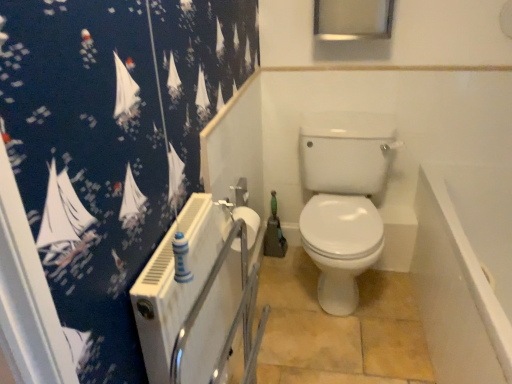
In order to face white glossy bathtub at lower right, should I rotate leftwards or rightwards?

A 31.511 degree turn to the right will do.

Where is `white glossy toilet at center`? white glossy toilet at center is located at coordinates (344, 199).

The image size is (512, 384). Describe the element at coordinates (344, 199) in the screenshot. I see `white glossy toilet at center` at that location.

This screenshot has height=384, width=512. What do you see at coordinates (247, 222) in the screenshot?
I see `white matte toilet paper at center` at bounding box center [247, 222].

This screenshot has height=384, width=512. In order to click on white glossy bathtub at lower right in this screenshot , I will do `click(456, 295)`.

From the image's perspective, is white matte toilet paper at center on top of white glossy toilet at center?

No.

Does white matte toilet paper at center have a larger size compared to white glossy toilet at center?

Incorrect, white matte toilet paper at center is not larger than white glossy toilet at center.

In terms of width, does white matte toilet paper at center look wider or thinner when compared to white glossy toilet at center?

Clearly, white matte toilet paper at center has less width compared to white glossy toilet at center.

You are a GUI agent. You are given a task and a screenshot of the screen. Output one action in this format:
    pyautogui.click(x=<x>, y=<y>)
    Task: Click on the toilet paper located in front of the white glossy toilet at center
    This screenshot has width=512, height=384.
    Given the screenshot: What is the action you would take?
    click(247, 222)

From the image's perspective, between white glossy toilet at center and white matte toilet paper at center, which one is located above?

white glossy toilet at center.

In the scene shown: Considering the positions of objects white glossy toilet at center and white matte toilet paper at center in the image provided, who is more to the right, white glossy toilet at center or white matte toilet paper at center?

white glossy toilet at center is more to the right.

Which of these two, white glossy toilet at center or white matte toilet paper at center, is wider?

Wider between the two is white glossy toilet at center.

Measure the distance from white glossy toilet at center to white matte toilet paper at center.

white glossy toilet at center is 20.13 inches away from white matte toilet paper at center.

Is white glossy bathtub at lower right positioned with its back to white glossy toilet at center?

No.

Where is `toilet behind the white glossy bathtub at lower right`? This screenshot has height=384, width=512. toilet behind the white glossy bathtub at lower right is located at coordinates (344, 199).

Between white glossy bathtub at lower right and white glossy toilet at center, which one has more height?

Standing taller between the two is white glossy toilet at center.

Between point (450, 380) and point (381, 136), which one is positioned behind?

The point (381, 136) is behind.

From a real-world perspective, does white matte toilet paper at center stand above white glossy bathtub at lower right?

Yes.

Consider the image. Is white matte toilet paper at center in front of or behind white glossy bathtub at lower right in the image?

In the image, white matte toilet paper at center appears behind white glossy bathtub at lower right.

From the image's perspective, is white matte toilet paper at center on top of white glossy bathtub at lower right?

Indeed, from the image's perspective, white matte toilet paper at center is shown above white glossy bathtub at lower right.

Considering the relative sizes of white glossy bathtub at lower right and white matte toilet paper at center in the image provided, is white glossy bathtub at lower right shorter than white matte toilet paper at center?

Incorrect, the height of white glossy bathtub at lower right does not fall short of that of white matte toilet paper at center.

In the scene shown: Is white glossy bathtub at lower right touching white matte toilet paper at center?

No, white glossy bathtub at lower right is not touching white matte toilet paper at center.

Is point (333, 291) in front of point (450, 246)?

No, (333, 291) is behind (450, 246).

Can you confirm if white glossy toilet at center is positioned to the right of white glossy bathtub at lower right?

No.

From a real-world perspective, relative to white glossy bathtub at lower right, is white glossy toilet at center vertically above or below?

Clearly, from a real-world perspective, white glossy toilet at center is above white glossy bathtub at lower right.

Identify the location of toilet located underneath the white matte toilet paper at center (from a real-world perspective). (344, 199).

At what (x,y) coordinates should I click in order to perform the action: click on toilet paper below the white glossy toilet at center (from the image's perspective). Please return your answer as a coordinate pair (x, y). The width and height of the screenshot is (512, 384). Looking at the image, I should click on (247, 222).

Considering their positions, is white matte toilet paper at center positioned closer to white glossy bathtub at lower right than white glossy toilet at center?

white glossy toilet at center is positioned closer to the anchor white glossy bathtub at lower right.

Estimate the real-world distances between objects in this image. Which object is further from white matte toilet paper at center, white glossy bathtub at lower right or white glossy toilet at center?

white glossy bathtub at lower right is positioned further to the anchor white matte toilet paper at center.

Based on their spatial positions, is white glossy toilet at center or white glossy bathtub at lower right further from white matte toilet paper at center?

white glossy bathtub at lower right lies further to white matte toilet paper at center than the other object.

Considering their positions, is white glossy bathtub at lower right positioned further to white glossy toilet at center than white matte toilet paper at center?

Among the two, white matte toilet paper at center is located further to white glossy toilet at center.

Looking at the image, which one is located closer to white glossy toilet at center, white matte toilet paper at center or white glossy bathtub at lower right?

Based on the image, white glossy bathtub at lower right appears to be nearer to white glossy toilet at center.

Estimate the real-world distances between objects in this image. Which object is closer to white glossy bathtub at lower right, white glossy toilet at center or white matte toilet paper at center?

white glossy toilet at center is positioned closer to the anchor white glossy bathtub at lower right.

At what (x,y) coordinates should I click in order to perform the action: click on toilet located between white matte toilet paper at center and white glossy bathtub at lower right in the left-right direction. Please return your answer as a coordinate pair (x, y). This screenshot has height=384, width=512. Looking at the image, I should click on (344, 199).